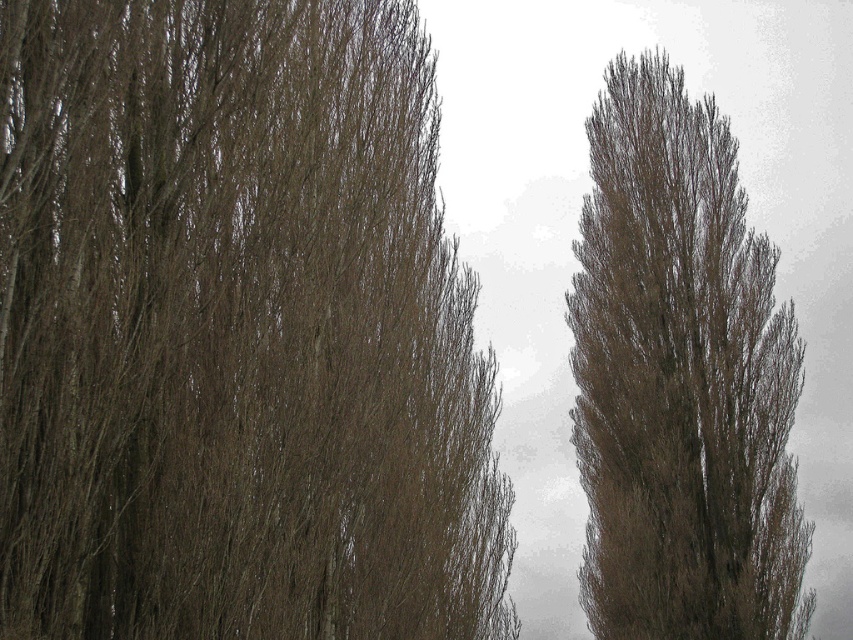
Does brown textured tree at center come behind brown textured tree at right?

No.

You are a GUI agent. You are given a task and a screenshot of the screen. Output one action in this format:
    pyautogui.click(x=<x>, y=<y>)
    Task: Click on the brown textured tree at center
    This screenshot has height=640, width=853.
    Given the screenshot: What is the action you would take?
    pyautogui.click(x=236, y=332)